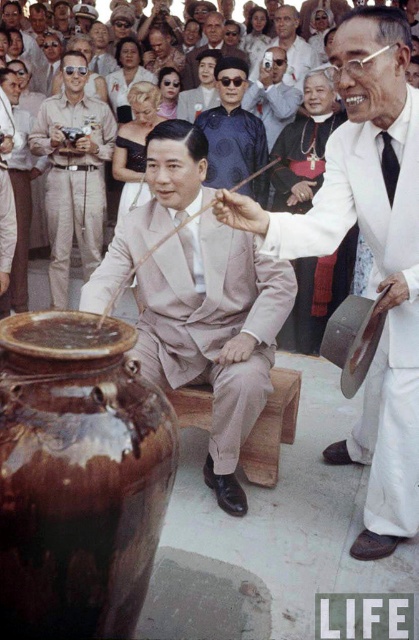
Does point (7, 344) lie in front of point (232, 45)?

Yes.

Is brown glazed vase at lower left further to camera compared to smooth blue suit at center?

No, it is in front of smooth blue suit at center.

Does point (101, 413) lie behind point (191, 58)?

No, (101, 413) is closer to viewer.

Locate an element on the screen. This screenshot has height=640, width=419. brown glazed vase at lower left is located at coordinates (77, 476).

Does brown glazed vase at lower left have a smaller size compared to khaki cotton uniform at left?

Yes, brown glazed vase at lower left is smaller than khaki cotton uniform at left.

Which is behind, point (67, 560) or point (67, 60)?

Point (67, 60)

Where is `brown glazed vase at lower left`? This screenshot has height=640, width=419. brown glazed vase at lower left is located at coordinates (77, 476).

Locate an element on the screen. brown glazed vase at lower left is located at coordinates (77, 476).

Between brown glazed vase at lower left and wooden stool at center, which one has more height?

With more height is brown glazed vase at lower left.

Is point (51, 604) more distant than point (266, 451)?

No, (51, 604) is in front of (266, 451).

Is point (88, 609) closer to viewer compared to point (191, 397)?

Yes, it is.

Where is `brown glazed vase at lower left`? The width and height of the screenshot is (419, 640). brown glazed vase at lower left is located at coordinates (77, 476).